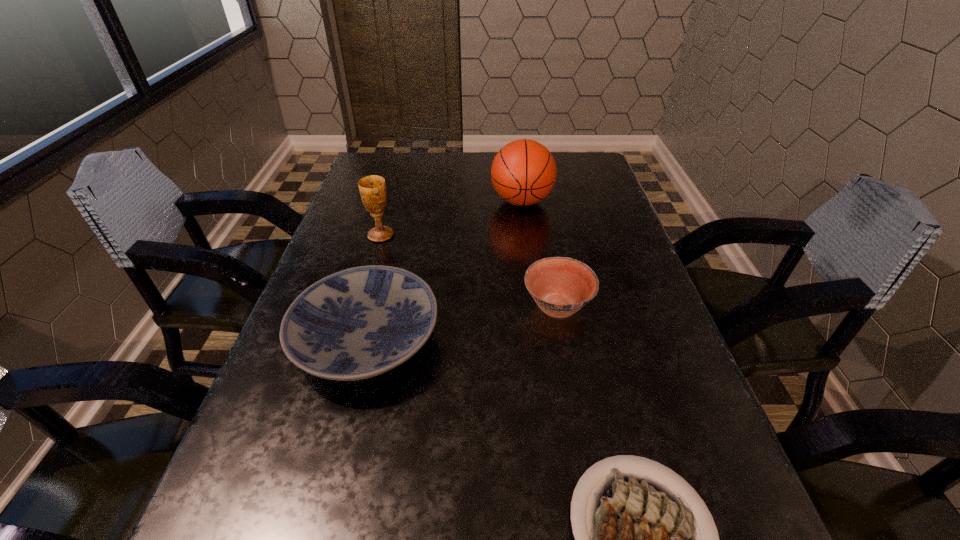
Locate an element on the screen. Image resolution: width=960 pixels, height=540 pixels. vacant space that is in between the basketball and the bowl is located at coordinates (540, 254).

The width and height of the screenshot is (960, 540). Identify the location of free spot between the second tallest object and the bowl. tap(468, 271).

Image resolution: width=960 pixels, height=540 pixels. I want to click on vacant area that lies between the fourth shortest object and the farthest object, so click(x=451, y=218).

At what (x,y) coordinates should I click in order to perform the action: click on object that is the closest one to the chalice. Please return your answer as a coordinate pair (x, y). Image resolution: width=960 pixels, height=540 pixels. Looking at the image, I should click on (361, 322).

Select which object appears as the second closest to the shortest object. Please provide its 2D coordinates. Your answer should be formatted as a tuple, i.e. [(x, y)], where the tuple contains the x and y coordinates of a point satisfying the conditions above.

[(560, 286)]